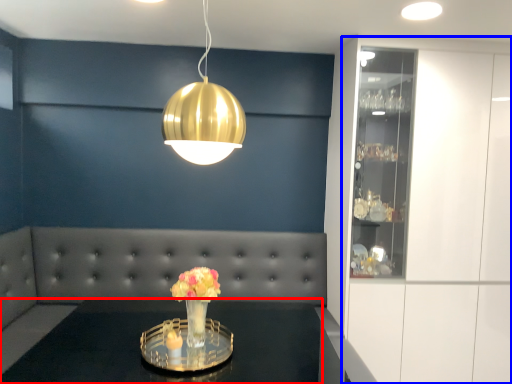
Question: Among these objects, which one is farthest to the camera, table (highlighted by a red box) or cabinetry (highlighted by a blue box)?

Choices:
 (A) table
 (B) cabinetry

Answer: (B)